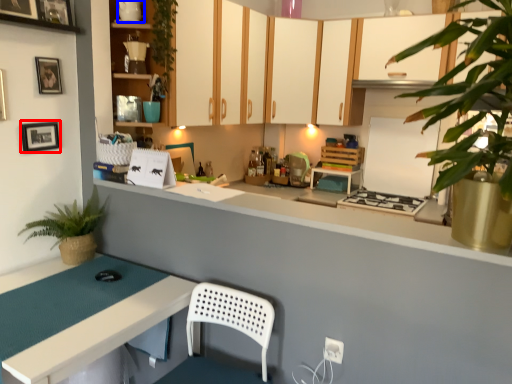
Question: Which object appears closest to the camera in this image, picture frame (highlighted by a red box) or appliance (highlighted by a blue box)?

Choices:
 (A) picture frame
 (B) appliance

Answer: (A)